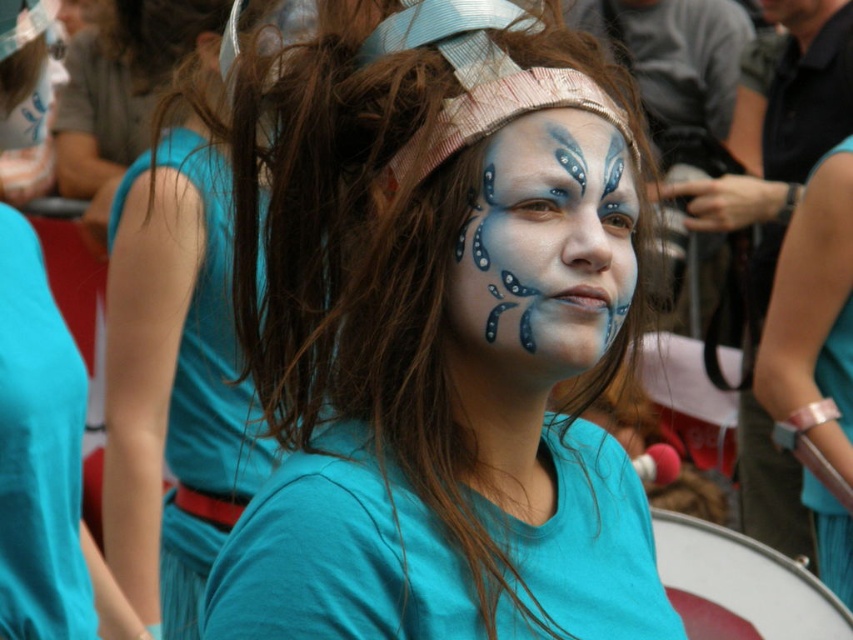
You are a photographer at the event and want to capture the matte blue face paint at center and the turquoise fabric dress at left in a single shot. Which object will appear larger in the photo?

The matte blue face paint at center will appear larger in the photo because it is closer to the viewer than the turquoise fabric dress at left.

You are a makeup artist at an event and need to apply face paint to a client. The client wants to ensure there is enough space between the matte blue face paint at center and the matte blue paint at center. Based on the image, is there sufficient space between them?

The matte blue face paint at center is only 4.79 inches away from the matte blue paint at center, so there is sufficient space between them.